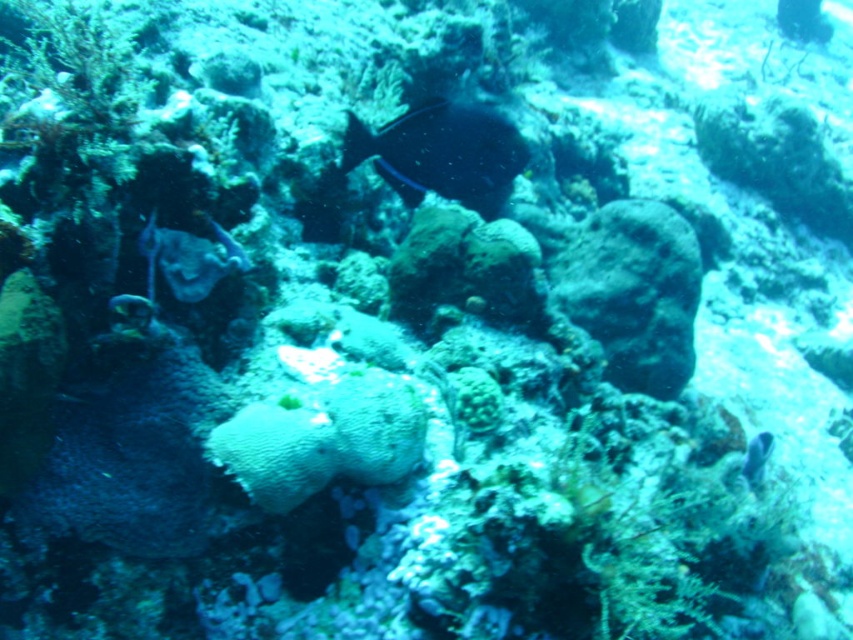
Question: Does shiny black fish at center have a greater width compared to shiny blue fish at lower right?

Choices:
 (A) yes
 (B) no

Answer: (A)

Question: Where is shiny black fish at center located in relation to shiny blue fish at lower right in the image?

Choices:
 (A) below
 (B) above

Answer: (B)

Question: Which of the following is the closest to the observer?

Choices:
 (A) shiny black fish at center
 (B) shiny blue fish at lower right

Answer: (A)

Question: Can you confirm if shiny black fish at center is smaller than shiny blue fish at lower right?

Choices:
 (A) yes
 (B) no

Answer: (B)